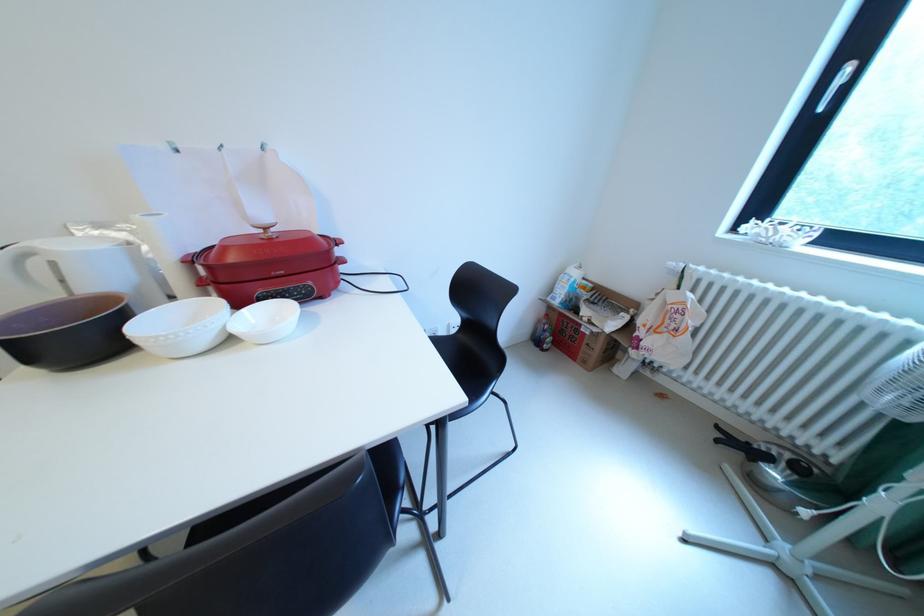
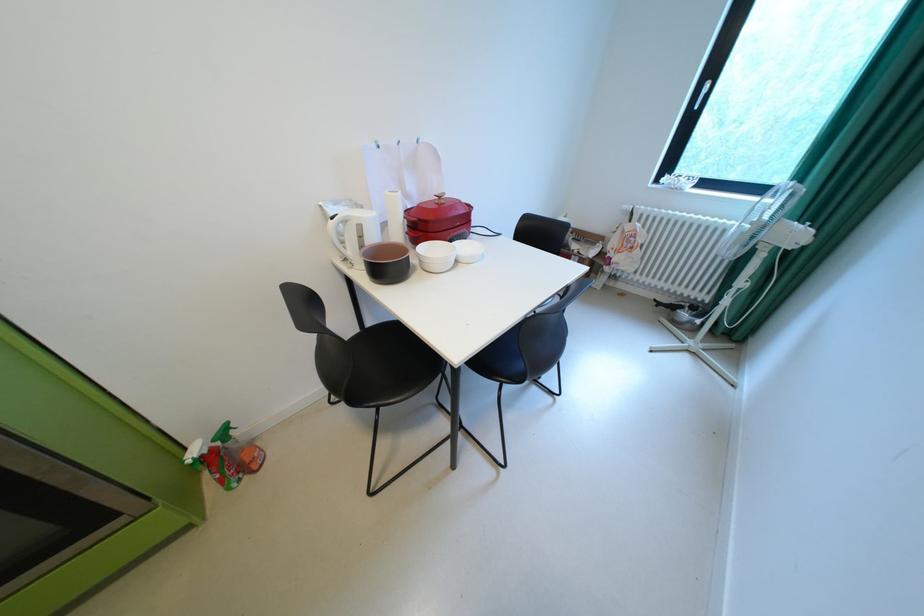
The point at (275,229) is marked in the first image. Where is the corresponding point in the second image?

(450, 198)